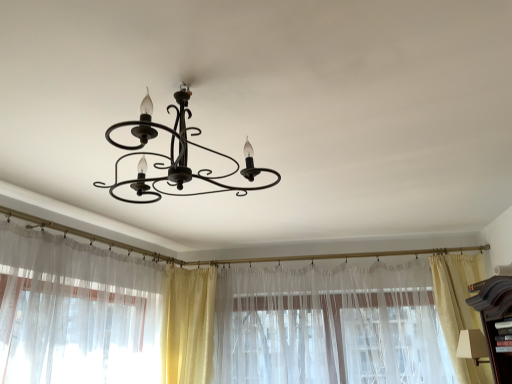
The height and width of the screenshot is (384, 512). Describe the element at coordinates (329, 326) in the screenshot. I see `translucent fabric curtain at center, the 2th curtain when ordered from right to left` at that location.

At what (x,y) coordinates should I click in order to perform the action: click on sheer white curtain at left, arranged as the first curtain when viewed from the left. Please return your answer as a coordinate pair (x, y). The width and height of the screenshot is (512, 384). Looking at the image, I should click on (76, 312).

What do you see at coordinates (76, 312) in the screenshot? I see `sheer white curtain at left, arranged as the first curtain when viewed from the left` at bounding box center [76, 312].

Describe the element at coordinates (459, 308) in the screenshot. This screenshot has width=512, height=384. I see `beige sheer curtain at right, the fourth curtain when ordered from left to right` at that location.

Identify the location of translucent fabric curtain at center, the 2th curtain when ordered from right to left. (329, 326).

Is translucent fabric curtain at center, the third curtain in the left-to-right sequence, smaller than beige sheer curtain at right, placed as the 1th curtain when sorted from right to left?

Actually, translucent fabric curtain at center, the third curtain in the left-to-right sequence, might be larger than beige sheer curtain at right, placed as the 1th curtain when sorted from right to left.

Is translucent fabric curtain at center, the 2th curtain when ordered from right to left, in front of or behind beige sheer curtain at right, the fourth curtain when ordered from left to right, in the image?

translucent fabric curtain at center, the 2th curtain when ordered from right to left, is positioned closer to the viewer than beige sheer curtain at right, the fourth curtain when ordered from left to right.

Is translucent fabric curtain at center, the 2th curtain when ordered from right to left, facing away from beige sheer curtain at right, placed as the 1th curtain when sorted from right to left?

That's right, translucent fabric curtain at center, the 2th curtain when ordered from right to left, is facing away from beige sheer curtain at right, placed as the 1th curtain when sorted from right to left.

Based on their positions, is translucent fabric curtain at center, the 2th curtain when ordered from right to left, located to the left or right of beige sheer curtain at right, placed as the 1th curtain when sorted from right to left?

Clearly, translucent fabric curtain at center, the 2th curtain when ordered from right to left, is on the left of beige sheer curtain at right, placed as the 1th curtain when sorted from right to left, in the image.

Considering the sizes of silky yellow curtain at center, which is counted as the second curtain, starting from the left, and beige sheer curtain at right, the fourth curtain when ordered from left to right, in the image, is silky yellow curtain at center, which is counted as the second curtain, starting from the left, taller or shorter than beige sheer curtain at right, the fourth curtain when ordered from left to right,?

Clearly, silky yellow curtain at center, which is counted as the second curtain, starting from the left, is shorter compared to beige sheer curtain at right, the fourth curtain when ordered from left to right.

From a real-world perspective, is silky yellow curtain at center, which appears as the third curtain when viewed from the right, below beige sheer curtain at right, placed as the 1th curtain when sorted from right to left?

No.

In terms of width, does silky yellow curtain at center, which is counted as the second curtain, starting from the left, look wider or thinner when compared to beige sheer curtain at right, the fourth curtain when ordered from left to right?

In the image, silky yellow curtain at center, which is counted as the second curtain, starting from the left, appears to be wider than beige sheer curtain at right, the fourth curtain when ordered from left to right.

Can you tell me how much silky yellow curtain at center, which is counted as the second curtain, starting from the left, and beige sheer curtain at right, the fourth curtain when ordered from left to right, differ in facing direction?

silky yellow curtain at center, which is counted as the second curtain, starting from the left, and beige sheer curtain at right, the fourth curtain when ordered from left to right, are facing 14 degrees away from each other.

Which object is thinner, silky yellow curtain at center, which is counted as the second curtain, starting from the left, or sheer white curtain at left, arranged as the first curtain when viewed from the left?

→ With smaller width is sheer white curtain at left, arranged as the first curtain when viewed from the left.

Would you say silky yellow curtain at center, which appears as the third curtain when viewed from the right, is inside or outside sheer white curtain at left, arranged as the first curtain when viewed from the left?

silky yellow curtain at center, which appears as the third curtain when viewed from the right, is enclosed within sheer white curtain at left, arranged as the first curtain when viewed from the left.

Consider the image. Considering the relative positions of silky yellow curtain at center, which is counted as the second curtain, starting from the left, and sheer white curtain at left, arranged as the first curtain when viewed from the left, in the image provided, is silky yellow curtain at center, which is counted as the second curtain, starting from the left, in front of sheer white curtain at left, arranged as the first curtain when viewed from the left,?

No, the depth of silky yellow curtain at center, which is counted as the second curtain, starting from the left, is greater than that of sheer white curtain at left, arranged as the first curtain when viewed from the left.

Can you confirm if silky yellow curtain at center, which is counted as the second curtain, starting from the left, is shorter than sheer white curtain at left, arranged as the first curtain when viewed from the left?

Indeed, silky yellow curtain at center, which is counted as the second curtain, starting from the left, has a lesser height compared to sheer white curtain at left, arranged as the first curtain when viewed from the left.

What's the angular difference between translucent fabric curtain at center, the 2th curtain when ordered from right to left, and silky yellow curtain at center, which appears as the third curtain when viewed from the right,'s facing directions?

The facing directions of translucent fabric curtain at center, the 2th curtain when ordered from right to left, and silky yellow curtain at center, which appears as the third curtain when viewed from the right, are 23.4 degrees apart.

Which of these two, translucent fabric curtain at center, the third curtain in the left-to-right sequence, or silky yellow curtain at center, which is counted as the second curtain, starting from the left, stands taller?

Standing taller between the two is translucent fabric curtain at center, the third curtain in the left-to-right sequence.

Is translucent fabric curtain at center, the third curtain in the left-to-right sequence, facing away from silky yellow curtain at center, which is counted as the second curtain, starting from the left?

No.

From the image's perspective, who appears lower, translucent fabric curtain at center, the third curtain in the left-to-right sequence, or silky yellow curtain at center, which is counted as the second curtain, starting from the left?

From the image's view, silky yellow curtain at center, which is counted as the second curtain, starting from the left, is below.

Between sheer white curtain at left, arranged as the first curtain when viewed from the left, and silky yellow curtain at center, which is counted as the second curtain, starting from the left, which one has more height?

sheer white curtain at left, arranged as the first curtain when viewed from the left.

I want to click on curtain on the left of silky yellow curtain at center, which is counted as the second curtain, starting from the left, so click(76, 312).

Does sheer white curtain at left, arranged as the first curtain when viewed from the left, lie behind silky yellow curtain at center, which appears as the third curtain when viewed from the right?

No, sheer white curtain at left, arranged as the first curtain when viewed from the left, is closer to the viewer.

Is silky yellow curtain at center, which appears as the third curtain when viewed from the right, at the back of sheer white curtain at left, arranged as the first curtain when viewed from the left?

No, sheer white curtain at left, arranged as the first curtain when viewed from the left,'s orientation is not away from silky yellow curtain at center, which appears as the third curtain when viewed from the right.

Considering the positions of point (159, 372) and point (463, 298), is point (159, 372) closer or farther from the camera than point (463, 298)?

Point (159, 372).

Identify the location of the 2nd curtain in front of the beige sheer curtain at right, the fourth curtain when ordered from left to right, counting from the anchor's position. This screenshot has height=384, width=512. pos(76,312).

Is sheer white curtain at left, the 4th curtain positioned from the right, in front of or behind beige sheer curtain at right, placed as the 1th curtain when sorted from right to left, in the image?

In the image, sheer white curtain at left, the 4th curtain positioned from the right, appears in front of beige sheer curtain at right, placed as the 1th curtain when sorted from right to left.

How far apart are translucent fabric curtain at center, the 2th curtain when ordered from right to left, and sheer white curtain at left, arranged as the first curtain when viewed from the left?

A distance of 3.82 feet exists between translucent fabric curtain at center, the 2th curtain when ordered from right to left, and sheer white curtain at left, arranged as the first curtain when viewed from the left.

Does translucent fabric curtain at center, the third curtain in the left-to-right sequence, have a greater height compared to sheer white curtain at left, arranged as the first curtain when viewed from the left?

Correct, translucent fabric curtain at center, the third curtain in the left-to-right sequence, is much taller as sheer white curtain at left, arranged as the first curtain when viewed from the left.

Choose the correct answer: Is translucent fabric curtain at center, the third curtain in the left-to-right sequence, inside sheer white curtain at left, the 4th curtain positioned from the right, or outside it?

translucent fabric curtain at center, the third curtain in the left-to-right sequence, is not enclosed by sheer white curtain at left, the 4th curtain positioned from the right.

The width and height of the screenshot is (512, 384). Find the location of `curtain that is the 1st one when counting forward from the beige sheer curtain at right, placed as the 1th curtain when sorted from right to left`. curtain that is the 1st one when counting forward from the beige sheer curtain at right, placed as the 1th curtain when sorted from right to left is located at coordinates (329, 326).

Locate an element on the screen. curtain that appears behind the beige sheer curtain at right, placed as the 1th curtain when sorted from right to left is located at coordinates (188, 325).

Based on their spatial positions, is sheer white curtain at left, the 4th curtain positioned from the right, or beige sheer curtain at right, placed as the 1th curtain when sorted from right to left, further from translucent fabric curtain at center, the 2th curtain when ordered from right to left?

sheer white curtain at left, the 4th curtain positioned from the right, is further to translucent fabric curtain at center, the 2th curtain when ordered from right to left.

Based on their spatial positions, is beige sheer curtain at right, the fourth curtain when ordered from left to right, or sheer white curtain at left, arranged as the first curtain when viewed from the left, closer to silky yellow curtain at center, which is counted as the second curtain, starting from the left?

Based on the image, sheer white curtain at left, arranged as the first curtain when viewed from the left, appears to be nearer to silky yellow curtain at center, which is counted as the second curtain, starting from the left.

Looking at the image, which one is located further to silky yellow curtain at center, which is counted as the second curtain, starting from the left, translucent fabric curtain at center, the third curtain in the left-to-right sequence, or sheer white curtain at left, arranged as the first curtain when viewed from the left?

translucent fabric curtain at center, the third curtain in the left-to-right sequence, is further to silky yellow curtain at center, which is counted as the second curtain, starting from the left.

Looking at this image, from the image, which object appears to be nearer to sheer white curtain at left, the 4th curtain positioned from the right, silky yellow curtain at center, which appears as the third curtain when viewed from the right, or translucent fabric curtain at center, the 2th curtain when ordered from right to left?

The object closer to sheer white curtain at left, the 4th curtain positioned from the right, is silky yellow curtain at center, which appears as the third curtain when viewed from the right.

Based on their spatial positions, is translucent fabric curtain at center, the 2th curtain when ordered from right to left, or beige sheer curtain at right, placed as the 1th curtain when sorted from right to left, closer to sheer white curtain at left, arranged as the first curtain when viewed from the left?

translucent fabric curtain at center, the 2th curtain when ordered from right to left.

Considering their positions, is beige sheer curtain at right, the fourth curtain when ordered from left to right, positioned further to translucent fabric curtain at center, the third curtain in the left-to-right sequence, than silky yellow curtain at center, which is counted as the second curtain, starting from the left?

Among the two, silky yellow curtain at center, which is counted as the second curtain, starting from the left, is located further to translucent fabric curtain at center, the third curtain in the left-to-right sequence.

Estimate the real-world distances between objects in this image. Which object is further from translucent fabric curtain at center, the 2th curtain when ordered from right to left, silky yellow curtain at center, which appears as the third curtain when viewed from the right, or beige sheer curtain at right, the fourth curtain when ordered from left to right?

silky yellow curtain at center, which appears as the third curtain when viewed from the right, lies further to translucent fabric curtain at center, the 2th curtain when ordered from right to left, than the other object.

Based on their spatial positions, is sheer white curtain at left, the 4th curtain positioned from the right, or translucent fabric curtain at center, the 2th curtain when ordered from right to left, further from beige sheer curtain at right, placed as the 1th curtain when sorted from right to left?

sheer white curtain at left, the 4th curtain positioned from the right.

Find the location of a particular element. The height and width of the screenshot is (384, 512). curtain situated between silky yellow curtain at center, which appears as the third curtain when viewed from the right, and beige sheer curtain at right, placed as the 1th curtain when sorted from right to left, from left to right is located at coordinates (329, 326).

This screenshot has width=512, height=384. Find the location of `curtain located between sheer white curtain at left, the 4th curtain positioned from the right, and translucent fabric curtain at center, the 2th curtain when ordered from right to left, in the left-right direction`. curtain located between sheer white curtain at left, the 4th curtain positioned from the right, and translucent fabric curtain at center, the 2th curtain when ordered from right to left, in the left-right direction is located at coordinates pyautogui.click(x=188, y=325).